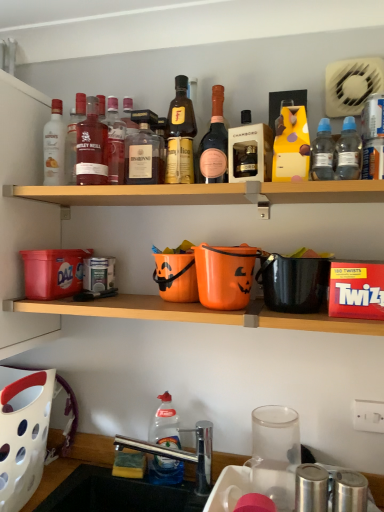
Question: Is wooden shelf at upper center closer to the viewer compared to matte glass bottle at center, which ranks as the 7th bottle in right-to-left order?

Choices:
 (A) no
 (B) yes

Answer: (B)

Question: Is wooden shelf at upper center placed right next to matte glass bottle at center, the 5th bottle positioned from the left?

Choices:
 (A) no
 (B) yes

Answer: (A)

Question: From the image's perspective, is wooden shelf at upper center located beneath matte glass bottle at center, which ranks as the 7th bottle in right-to-left order?

Choices:
 (A) yes
 (B) no

Answer: (A)

Question: Is wooden shelf at upper center taller than matte glass bottle at center, which ranks as the 7th bottle in right-to-left order?

Choices:
 (A) yes
 (B) no

Answer: (B)

Question: Considering the relative positions of wooden shelf at upper center and matte glass bottle at center, which ranks as the 7th bottle in right-to-left order, in the image provided, is wooden shelf at upper center to the right of matte glass bottle at center, which ranks as the 7th bottle in right-to-left order, from the viewer's perspective?

Choices:
 (A) no
 (B) yes

Answer: (B)

Question: Is point (49, 178) closer or farther from the camera than point (377, 177)?

Choices:
 (A) farther
 (B) closer

Answer: (A)

Question: Which is correct: matte white bottle at upper left, the eleventh bottle positioned from the right, is inside white plastic can at upper right, which is the 1th bottle from right to left, or outside of it?

Choices:
 (A) outside
 (B) inside

Answer: (A)

Question: From a real-world perspective, is matte white bottle at upper left, which is the first bottle from left to right, positioned above or below white plastic can at upper right, which is the 1th bottle from right to left?

Choices:
 (A) above
 (B) below

Answer: (B)

Question: In the image, is matte white bottle at upper left, which is the first bottle from left to right, positioned in front of or behind white plastic can at upper right, which is the 1th bottle from right to left?

Choices:
 (A) behind
 (B) front

Answer: (A)

Question: In the image, is clear plastic bottle at upper right, arranged as the third bottle when viewed from the right, positioned in front of or behind clear plastic bottle at sink, which appears as the sixth bottle when viewed from the left?

Choices:
 (A) front
 (B) behind

Answer: (A)

Question: In terms of width, does clear plastic bottle at upper right, arranged as the third bottle when viewed from the right, look wider or thinner when compared to clear plastic bottle at sink, which appears as the sixth bottle when viewed from the left?

Choices:
 (A) wide
 (B) thin

Answer: (B)

Question: Would you say clear plastic bottle at upper right, arranged as the third bottle when viewed from the right, is inside or outside clear plastic bottle at sink, which appears as the sixth bottle when viewed from the left?

Choices:
 (A) outside
 (B) inside

Answer: (A)

Question: In terms of height, does clear plastic bottle at upper right, arranged as the third bottle when viewed from the right, look taller or shorter compared to clear plastic bottle at sink, which appears as the sixth bottle when viewed from the left?

Choices:
 (A) short
 (B) tall

Answer: (A)

Question: Is point (59, 170) closer or farther from the camera than point (319, 167)?

Choices:
 (A) farther
 (B) closer

Answer: (A)

Question: Is matte white bottle at upper left, the eleventh bottle positioned from the right, inside or outside of clear plastic bottle at upper right, arranged as the third bottle when viewed from the right?

Choices:
 (A) outside
 (B) inside

Answer: (A)